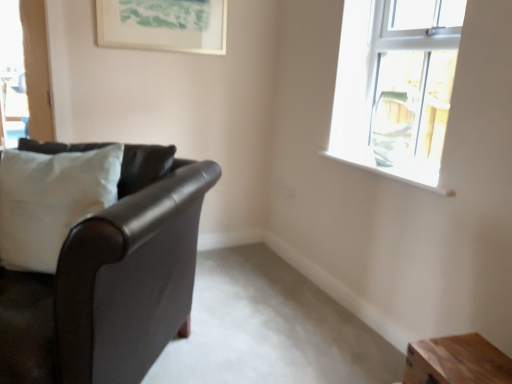
Question: Should I look upward or downward to see leather couch at left?

Choices:
 (A) up
 (B) down

Answer: (B)

Question: Can white fabric pillow at left be found inside clear glass window at upper right?

Choices:
 (A) yes
 (B) no

Answer: (B)

Question: From a real-world perspective, is clear glass window at upper right over white fabric pillow at left?

Choices:
 (A) yes
 (B) no

Answer: (A)

Question: Is clear glass window at upper right wider than white fabric pillow at left?

Choices:
 (A) no
 (B) yes

Answer: (B)

Question: Is clear glass window at upper right outside of white fabric pillow at left?

Choices:
 (A) yes
 (B) no

Answer: (A)

Question: From the image's perspective, does clear glass window at upper right appear lower than white fabric pillow at left?

Choices:
 (A) yes
 (B) no

Answer: (B)

Question: Does clear glass window at upper right have a larger size compared to white fabric pillow at left?

Choices:
 (A) yes
 (B) no

Answer: (A)

Question: Is white fabric pillow at left not inside white fabric swivel chair at upper right?

Choices:
 (A) no
 (B) yes

Answer: (B)

Question: Does white fabric pillow at left have a greater height compared to white fabric swivel chair at upper right?

Choices:
 (A) yes
 (B) no

Answer: (A)

Question: From a real-world perspective, is white fabric pillow at left on top of white fabric swivel chair at upper right?

Choices:
 (A) no
 (B) yes

Answer: (A)

Question: Does white fabric pillow at left have a smaller size compared to white fabric swivel chair at upper right?

Choices:
 (A) no
 (B) yes

Answer: (A)

Question: Can you confirm if white fabric pillow at left is positioned to the left of white fabric swivel chair at upper right?

Choices:
 (A) no
 (B) yes

Answer: (B)

Question: Can you confirm if white fabric pillow at left is wider than white fabric swivel chair at upper right?

Choices:
 (A) no
 (B) yes

Answer: (B)

Question: Is there a large distance between clear glass window at upper right and wooden table at lower right?

Choices:
 (A) no
 (B) yes

Answer: (A)